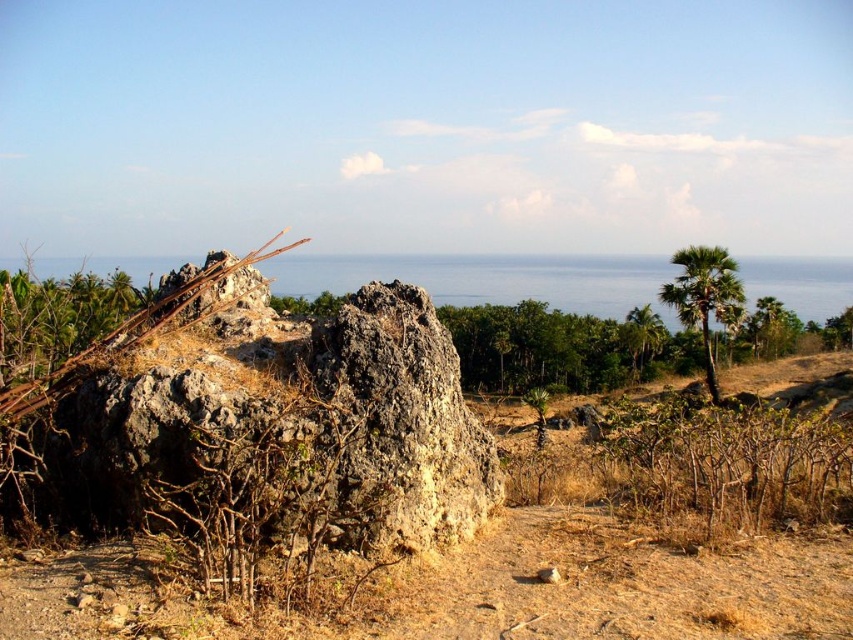
Who is more distant from viewer, (561, 380) or (722, 288)?

The point (561, 380) is behind.

Does green leafy trees at center have a lesser height compared to green leafy palm tree at upper right?

In fact, green leafy trees at center may be taller than green leafy palm tree at upper right.

This screenshot has width=853, height=640. What are the coordinates of `green leafy trees at center` in the screenshot? It's located at (550, 348).

Does gray rough rock at center have a lesser height compared to green leafy palm tree at upper right?

Correct, gray rough rock at center is not as tall as green leafy palm tree at upper right.

Measure the distance from gray rough rock at center to green leafy palm tree at upper right.

gray rough rock at center is 43.08 meters away from green leafy palm tree at upper right.

Does point (386, 536) come behind point (706, 323)?

No, (386, 536) is in front of (706, 323).

Locate an element on the screen. gray rough rock at center is located at coordinates (276, 420).

Which of these two, gray rough rock at center or green leafy trees at center, stands shorter?

Standing shorter between the two is gray rough rock at center.

Does gray rough rock at center have a smaller size compared to green leafy trees at center?

Yes, gray rough rock at center is smaller than green leafy trees at center.

What do you see at coordinates (276, 420) in the screenshot? This screenshot has width=853, height=640. I see `gray rough rock at center` at bounding box center [276, 420].

Where is `gray rough rock at center`? gray rough rock at center is located at coordinates (276, 420).